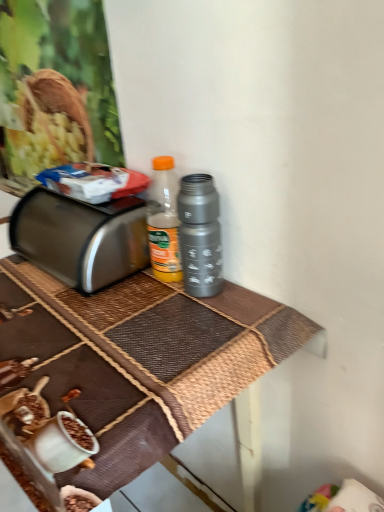
Question: Are metallic brown table at center and metallic gray thermos at center making contact?

Choices:
 (A) no
 (B) yes

Answer: (A)

Question: Is metallic brown table at center oriented away from metallic gray thermos at center?

Choices:
 (A) yes
 (B) no

Answer: (B)

Question: From a real-world perspective, is metallic brown table at center positioned under metallic gray thermos at center based on gravity?

Choices:
 (A) yes
 (B) no

Answer: (A)

Question: Can you confirm if metallic brown table at center is shorter than metallic gray thermos at center?

Choices:
 (A) yes
 (B) no

Answer: (B)

Question: Can you confirm if metallic brown table at center is taller than metallic gray thermos at center?

Choices:
 (A) yes
 (B) no

Answer: (A)

Question: Can we say metallic brown table at center lies outside metallic gray thermos at center?

Choices:
 (A) yes
 (B) no

Answer: (A)

Question: Does metallic gray thermos at center have a greater height compared to metallic brown table at center?

Choices:
 (A) yes
 (B) no

Answer: (B)

Question: Is metallic gray thermos at center oriented towards metallic brown table at center?

Choices:
 (A) no
 (B) yes

Answer: (A)

Question: Would you say metallic gray thermos at center contains metallic brown table at center?

Choices:
 (A) yes
 (B) no

Answer: (B)

Question: Can you confirm if metallic gray thermos at center is wider than metallic brown table at center?

Choices:
 (A) no
 (B) yes

Answer: (A)

Question: Can you confirm if metallic gray thermos at center is bigger than metallic brown table at center?

Choices:
 (A) yes
 (B) no

Answer: (B)

Question: Is metallic gray thermos at center turned away from metallic brown table at center?

Choices:
 (A) yes
 (B) no

Answer: (B)

Question: Does satin silver toaster at left have a larger size compared to metallic gray thermos at center?

Choices:
 (A) no
 (B) yes

Answer: (B)